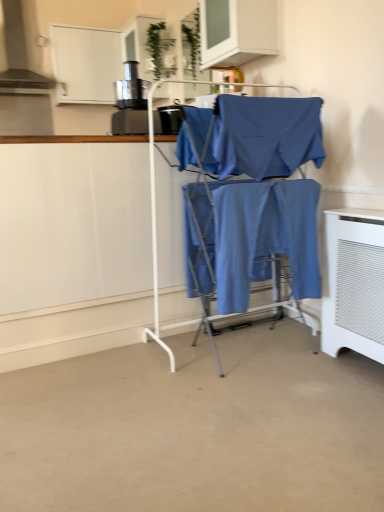
Question: From the image's perspective, is blue cotton fabric at center, the first fabric in the top-to-bottom sequence, below blue cotton pants at center, the first fabric when ordered from bottom to top?

Choices:
 (A) no
 (B) yes

Answer: (A)

Question: Is blue cotton fabric at center, which is the second fabric from bottom to top, at the left side of blue cotton pants at center, which is counted as the second fabric, starting from the top?

Choices:
 (A) no
 (B) yes

Answer: (B)

Question: Is blue cotton fabric at center, the first fabric in the top-to-bottom sequence, aimed at blue cotton pants at center, which is counted as the second fabric, starting from the top?

Choices:
 (A) yes
 (B) no

Answer: (B)

Question: Considering the relative positions of blue cotton fabric at center, which is the second fabric from bottom to top, and blue cotton pants at center, the first fabric when ordered from bottom to top, in the image provided, is blue cotton fabric at center, which is the second fabric from bottom to top, to the right of blue cotton pants at center, the first fabric when ordered from bottom to top, from the viewer's perspective?

Choices:
 (A) no
 (B) yes

Answer: (A)

Question: Does blue cotton fabric at center, which is the second fabric from bottom to top, have a smaller size compared to blue cotton pants at center, which is counted as the second fabric, starting from the top?

Choices:
 (A) no
 (B) yes

Answer: (A)

Question: Considering the relative sizes of blue cotton fabric at center, which is the second fabric from bottom to top, and blue cotton pants at center, which is counted as the second fabric, starting from the top, in the image provided, is blue cotton fabric at center, which is the second fabric from bottom to top, taller than blue cotton pants at center, which is counted as the second fabric, starting from the top,?

Choices:
 (A) no
 (B) yes

Answer: (A)

Question: Would you say white mesh radiator at lower right is a long distance from matte blue fabric at center?

Choices:
 (A) yes
 (B) no

Answer: (A)

Question: Considering the relative positions of white mesh radiator at lower right and matte blue fabric at center in the image provided, is white mesh radiator at lower right behind matte blue fabric at center?

Choices:
 (A) no
 (B) yes

Answer: (A)

Question: Is white mesh radiator at lower right to the right of matte blue fabric at center from the viewer's perspective?

Choices:
 (A) no
 (B) yes

Answer: (B)

Question: Can you confirm if white mesh radiator at lower right is shorter than matte blue fabric at center?

Choices:
 (A) yes
 (B) no

Answer: (A)

Question: From the image's perspective, does white mesh radiator at lower right appear lower than matte blue fabric at center?

Choices:
 (A) no
 (B) yes

Answer: (B)

Question: Considering the relative sizes of white mesh radiator at lower right and matte blue fabric at center in the image provided, is white mesh radiator at lower right bigger than matte blue fabric at center?

Choices:
 (A) yes
 (B) no

Answer: (B)

Question: Can you confirm if blue cotton pants at center, which is counted as the second fabric, starting from the top, is smaller than metallic black coffee machine at upper left?

Choices:
 (A) no
 (B) yes

Answer: (A)